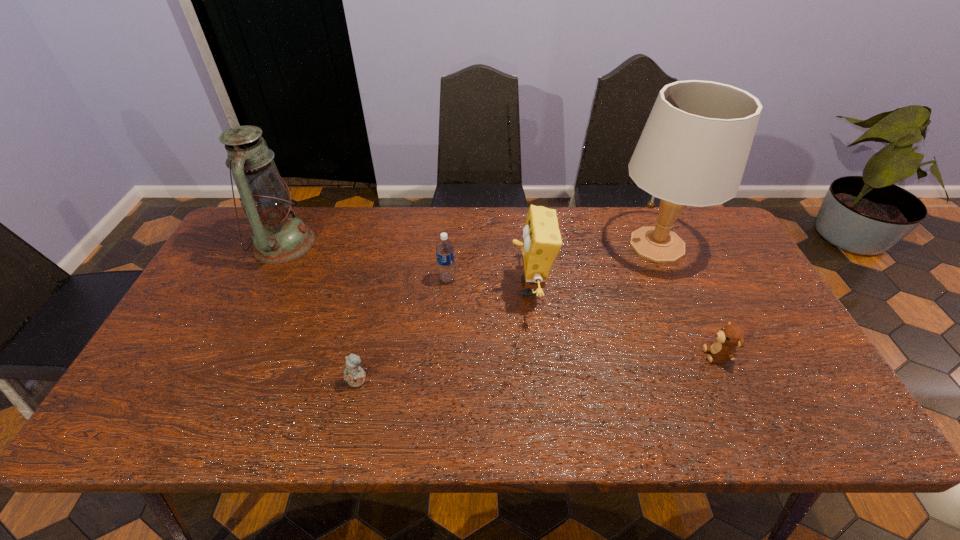
This screenshot has width=960, height=540. I want to click on vacant space at the right edge, so click(x=714, y=311).

The image size is (960, 540). I want to click on vacant area at the far right corner of the desktop, so click(x=708, y=220).

This screenshot has height=540, width=960. What are the coordinates of `unoccupied position between the table lamp and the fourth object from left to right` in the screenshot? It's located at (593, 266).

Find the location of a particular element. This screenshot has height=540, width=960. free space that is in between the right teddy bear and the table lamp is located at coordinates (687, 300).

Locate an element on the screen. The image size is (960, 540). vacant space that is in between the table lamp and the left teddy bear is located at coordinates (508, 313).

The height and width of the screenshot is (540, 960). Find the location of `unoccupied area between the oil lamp and the fourth object from right to left`. unoccupied area between the oil lamp and the fourth object from right to left is located at coordinates (366, 261).

Identify the location of free space between the sponge and the oil lamp. The image size is (960, 540). (407, 265).

Locate an element on the screen. This screenshot has width=960, height=540. vacant space in between the nearest object and the water bottle is located at coordinates (402, 330).

Identify the location of free space between the third object from right to left and the fifth farthest object. The width and height of the screenshot is (960, 540). (624, 321).

In order to click on vacant space that is in between the table lamp and the nearest object in this screenshot , I will do `click(508, 313)`.